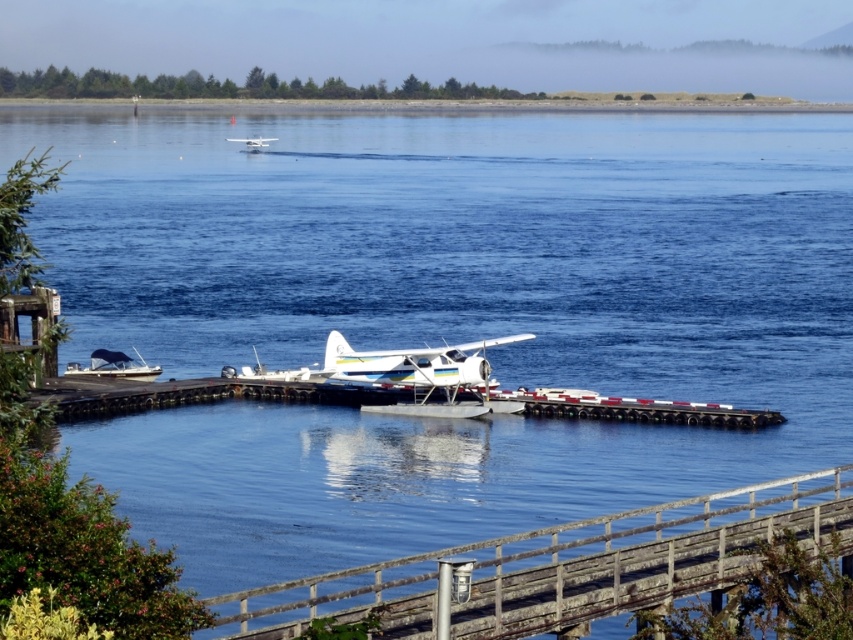
You are a photographer planning to capture the white matte boat at lower left and the white matte seaplane at upper center in a single shot. Based on their sizes in the image, which object would appear smaller in the photo?

The white matte boat at lower left appears smaller in the photo because it is shorter than the white matte seaplane at upper center.

You are a photographer planning to take a photo of the white wood dock at center and the white matte seaplane at center. Which object should you focus on first if you want to capture both in the frame without moving the camera?

The white wood dock at center is larger in size compared to the white matte seaplane at center, so you should focus on the white matte seaplane at center first to ensure it fits within the frame.